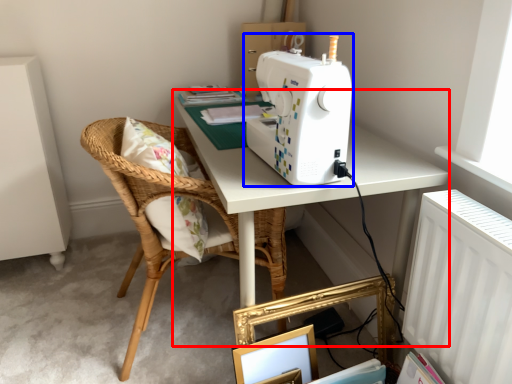
Question: Which point is further to the camera, table (highlighted by a red box) or sewing machine (highlighted by a blue box)?

Choices:
 (A) table
 (B) sewing machine

Answer: (A)